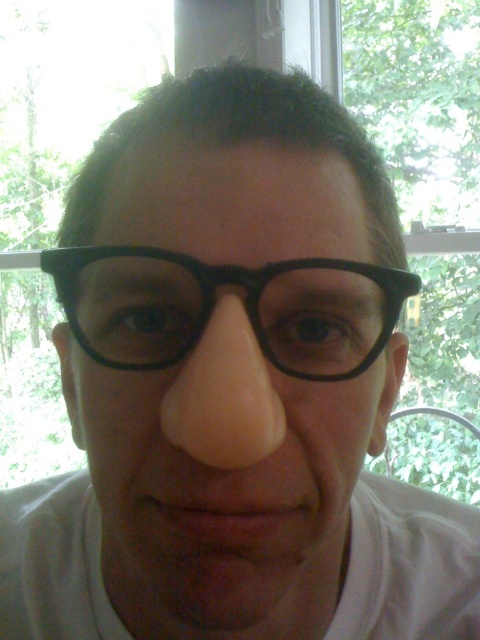
Question: Does matte black glasses at center appear under black plastic glasses at center?

Choices:
 (A) yes
 (B) no

Answer: (A)

Question: Does matte black glasses at center come behind black plastic glasses at center?

Choices:
 (A) yes
 (B) no

Answer: (B)

Question: Is matte black glasses at center further to the viewer compared to black plastic glasses at center?

Choices:
 (A) no
 (B) yes

Answer: (A)